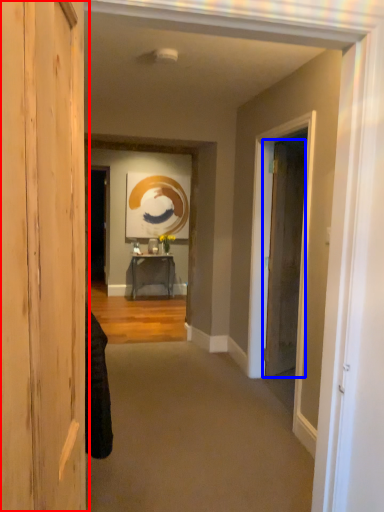
Question: Which point is further to the camera, door (highlighted by a red box) or door (highlighted by a blue box)?

Choices:
 (A) door
 (B) door

Answer: (B)